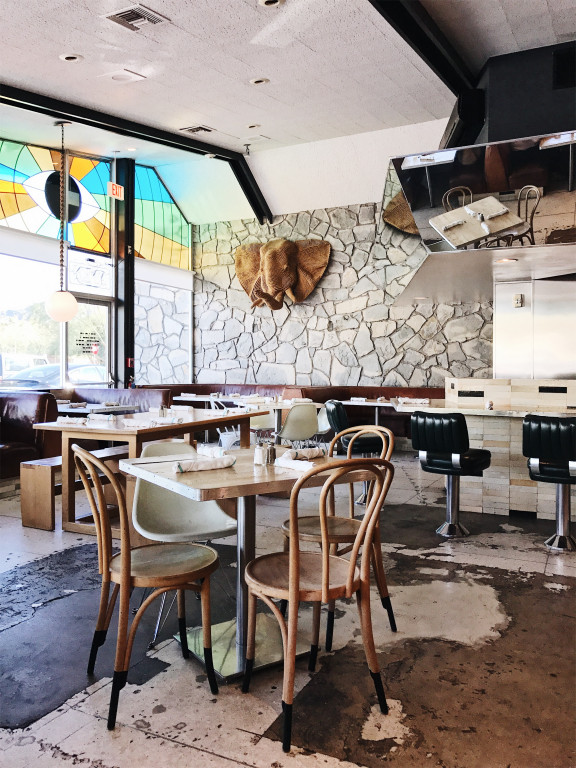
This screenshot has height=768, width=576. In order to click on flooring in this screenshot , I will do `click(469, 743)`.